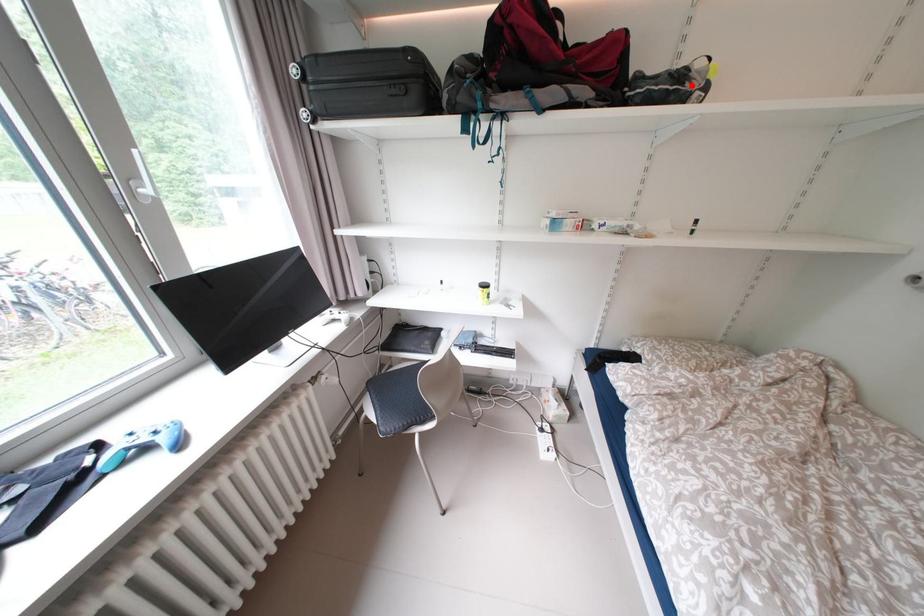
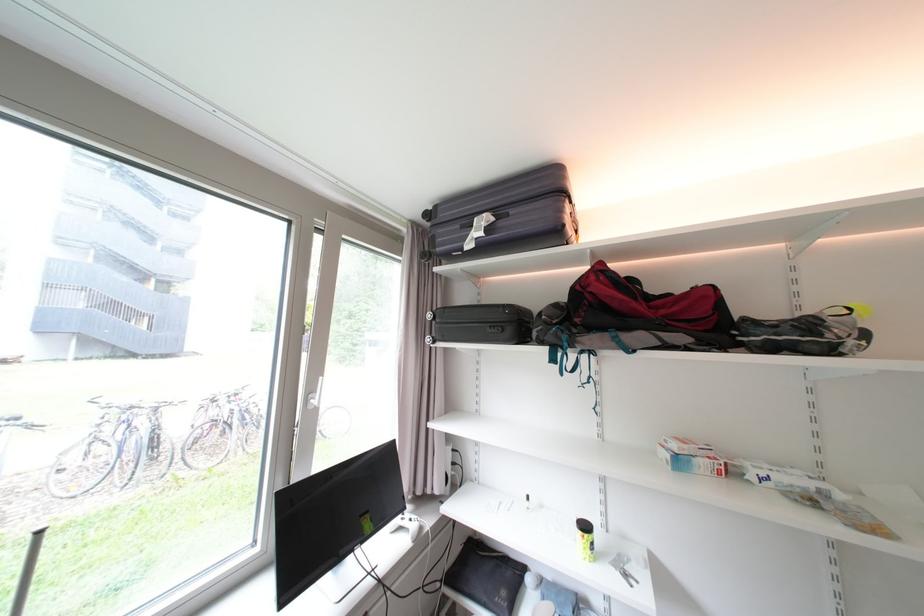
Locate, in the second image, the point that corresponds to the highlighted location in the first image.

(830, 337)